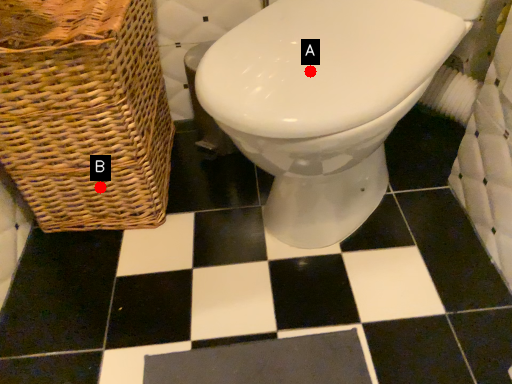
Question: Two points are circled on the image, labeled by A and B beside each circle. Among these points, which one is farthest from the camera?

Choices:
 (A) A is further
 (B) B is further

Answer: (B)